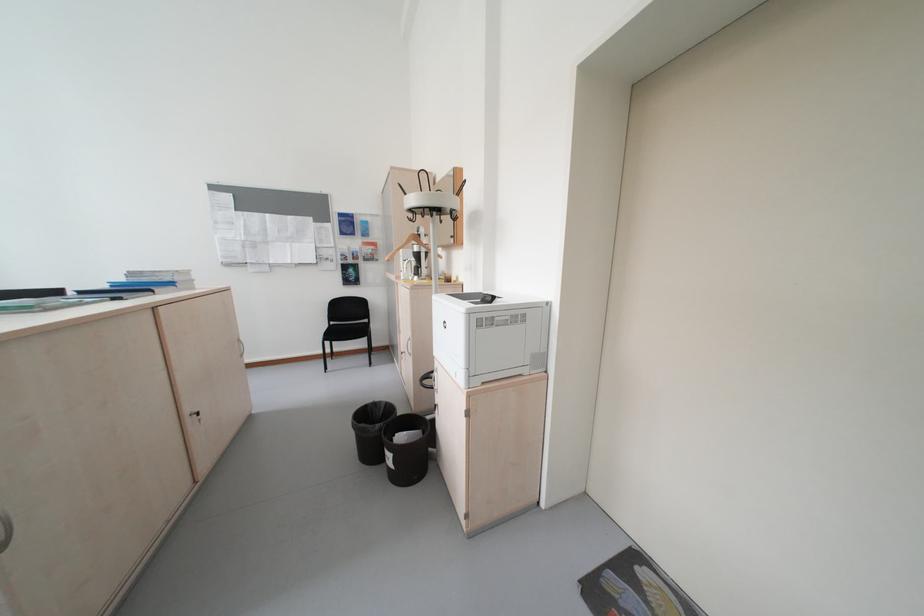
Find where to pull the black cabinet handle. Please return your answer as a coordinate pair (x, y).

(195, 416)